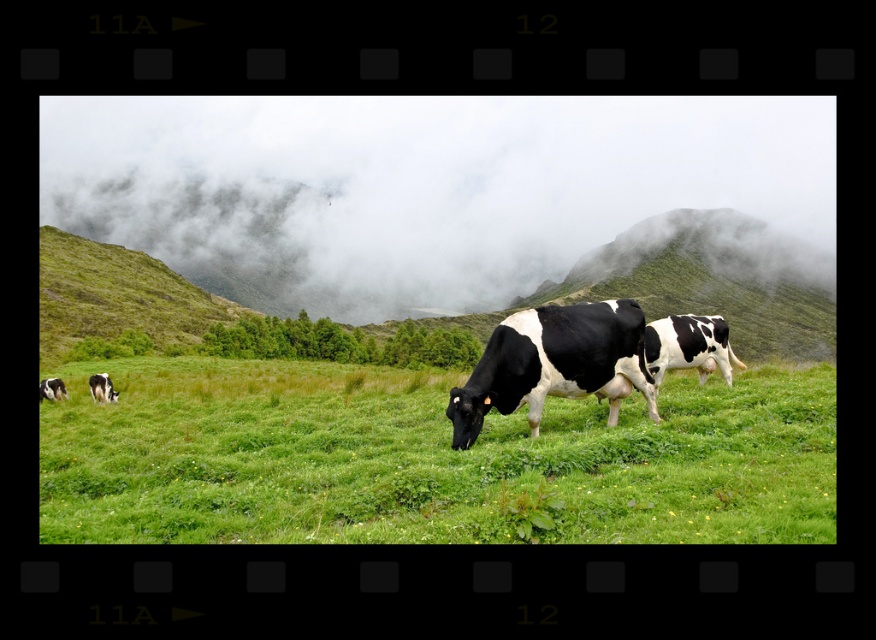
Can you confirm if green grassy pasture at center is wider than black and white spotted cow at center?

Yes.

Who is positioned more to the left, green grassy pasture at center or black and white spotted cow at center?

From the viewer's perspective, green grassy pasture at center appears more on the left side.

Who is more forward, (x=373, y=413) or (x=587, y=326)?

Point (x=587, y=326) is in front.

Image resolution: width=876 pixels, height=640 pixels. I want to click on green grassy pasture at center, so click(x=428, y=460).

Is point (538, 186) farther from camera compared to point (532, 330)?

Yes, it is.

Can you confirm if foggy misty clouds at upper center is positioned above black and white spotted cow at center?

Correct, foggy misty clouds at upper center is located above black and white spotted cow at center.

The image size is (876, 640). What do you see at coordinates (419, 188) in the screenshot? I see `foggy misty clouds at upper center` at bounding box center [419, 188].

Find the location of `foggy misty clouds at upper center`. foggy misty clouds at upper center is located at coordinates (419, 188).

Which is in front, point (227, 100) or point (721, 452)?

Point (721, 452) is in front.

Where is `foggy misty clouds at upper center`? This screenshot has height=640, width=876. foggy misty clouds at upper center is located at coordinates (419, 188).